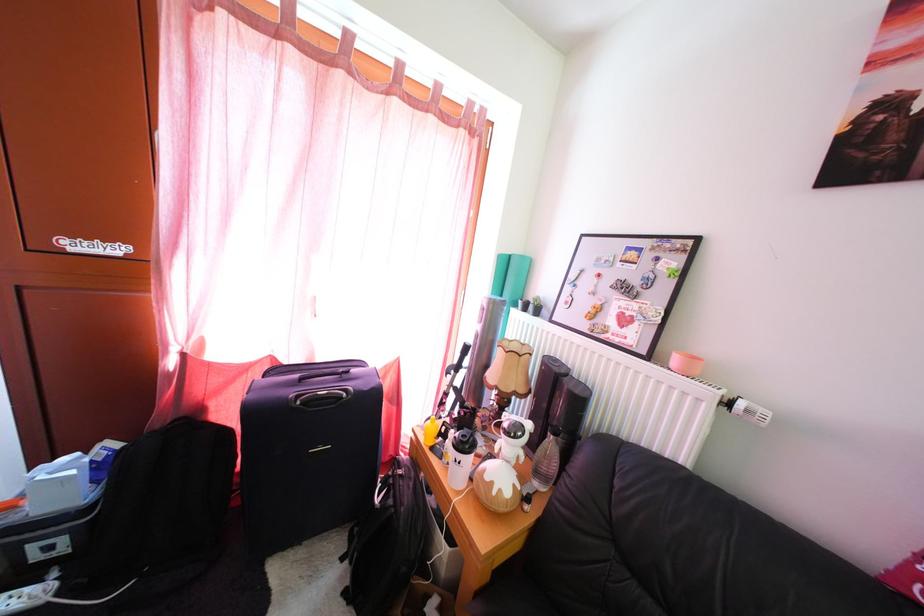
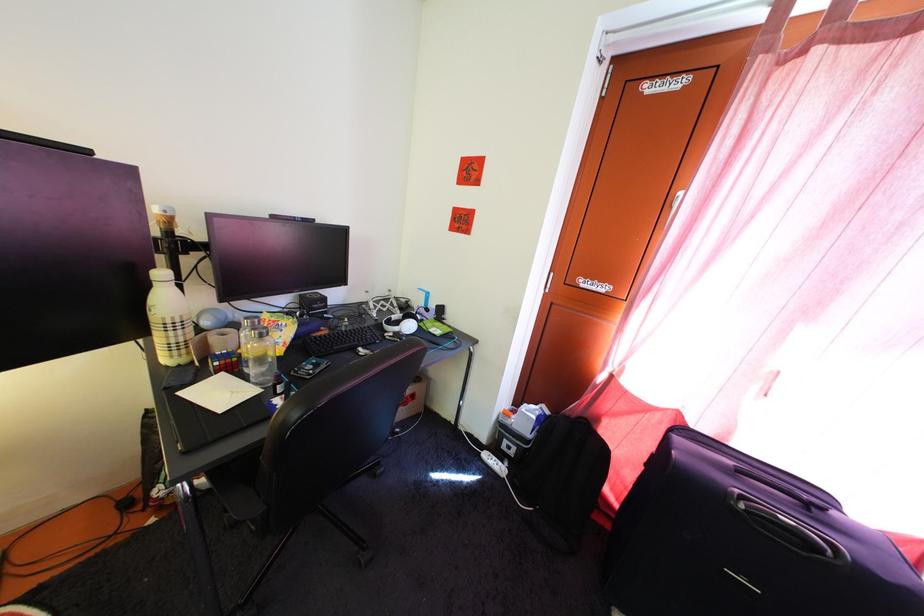
Question: The camera is either moving clockwise (left) or counter-clockwise (right) around the object. The first image is from the beginning of the video and the second image is from the end. Is the camera moving left or right when shooting the video?

Choices:
 (A) Left
 (B) Right

Answer: (B)